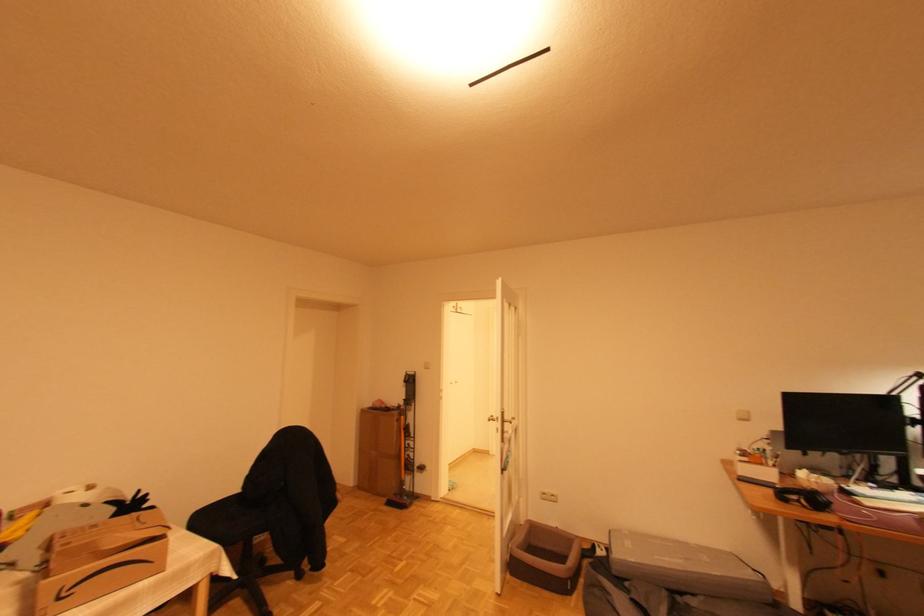
Find where to push the metal door handle. Please return your answer as a coordinate pair (x, y).

(508, 442)